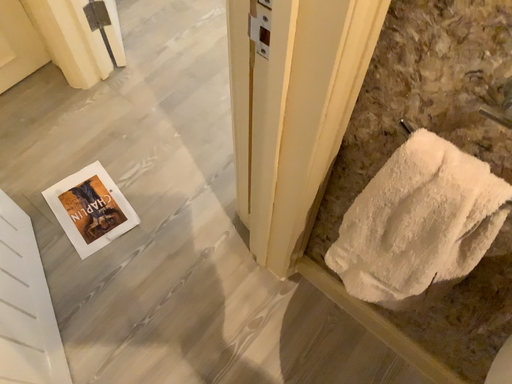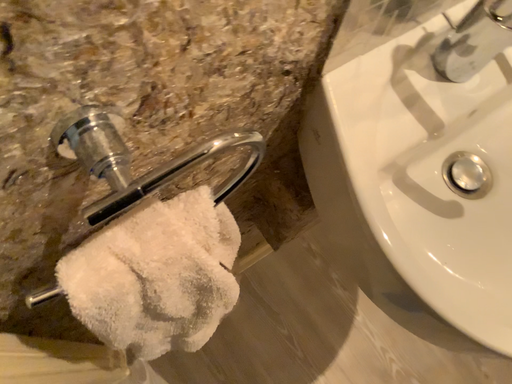
Question: Which way did the camera rotate in the video?

Choices:
 (A) rotated upward
 (B) rotated downward

Answer: (A)